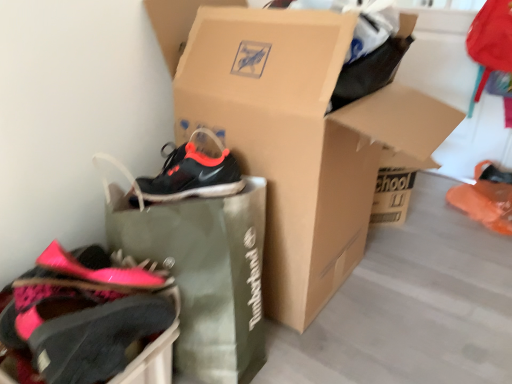
Question: Is point (333, 155) closer or farther from the camera than point (73, 359)?

Choices:
 (A) closer
 (B) farther

Answer: (B)

Question: Considering their positions, is cardboard shoebox at center located in front of or behind pink fabric shoe at lower left, placed as the 2th footwear when sorted from right to left?

Choices:
 (A) front
 (B) behind

Answer: (B)

Question: Based on their relative distances, which object is farther from the pink fabric shoe at lower left, placed as the 2th footwear when sorted from right to left?

Choices:
 (A) green fabric shopping bag at center
 (B) orange matte shoe at lower right, which is the 1th footwear from back to front
 (C) cardboard shoebox at center

Answer: (B)

Question: Which object is positioned farthest from the green fabric shopping bag at center?

Choices:
 (A) cardboard shoebox at center
 (B) orange matte shoe at lower right, which is the 1th footwear from back to front
 (C) pink fabric shoe at lower left, placed as the 2th footwear when sorted from right to left

Answer: (B)